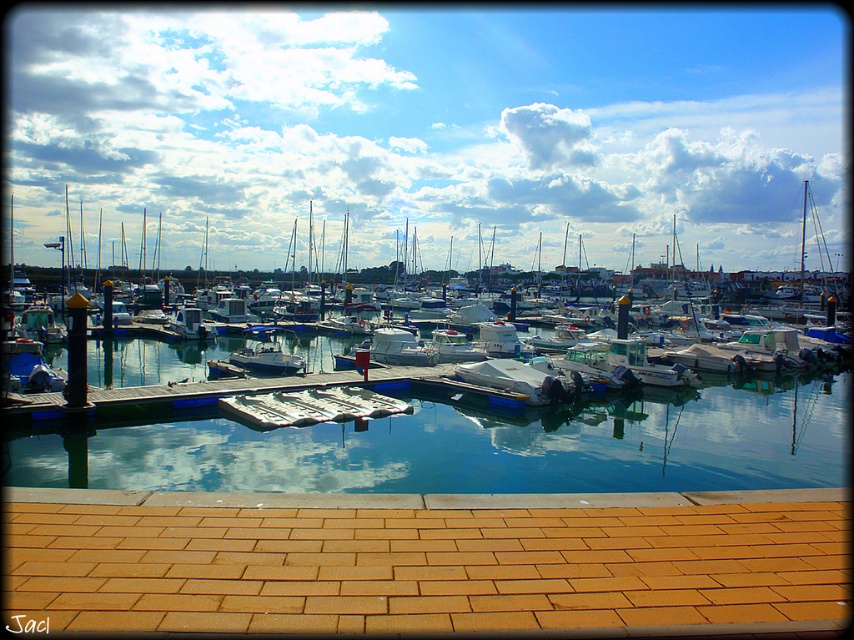
Question: In this image, where is brick at lower center located relative to white glossy motorboat at center?

Choices:
 (A) above
 (B) below

Answer: (B)

Question: Among these points, which one is farthest from the camera?

Choices:
 (A) (592, 460)
 (B) (238, 317)

Answer: (B)

Question: Which is nearer to the brick at lower center?

Choices:
 (A) white matte boat at center
 (B) clear glass water at center

Answer: (B)

Question: Which point is farther from the camera taking this photo?

Choices:
 (A) (320, 547)
 (B) (276, 358)

Answer: (B)

Question: Is brick at lower center to the right of white matte boat at center from the viewer's perspective?

Choices:
 (A) yes
 (B) no

Answer: (A)

Question: Can you confirm if white matte boat at center is thinner than white glossy motorboat at center?

Choices:
 (A) no
 (B) yes

Answer: (A)